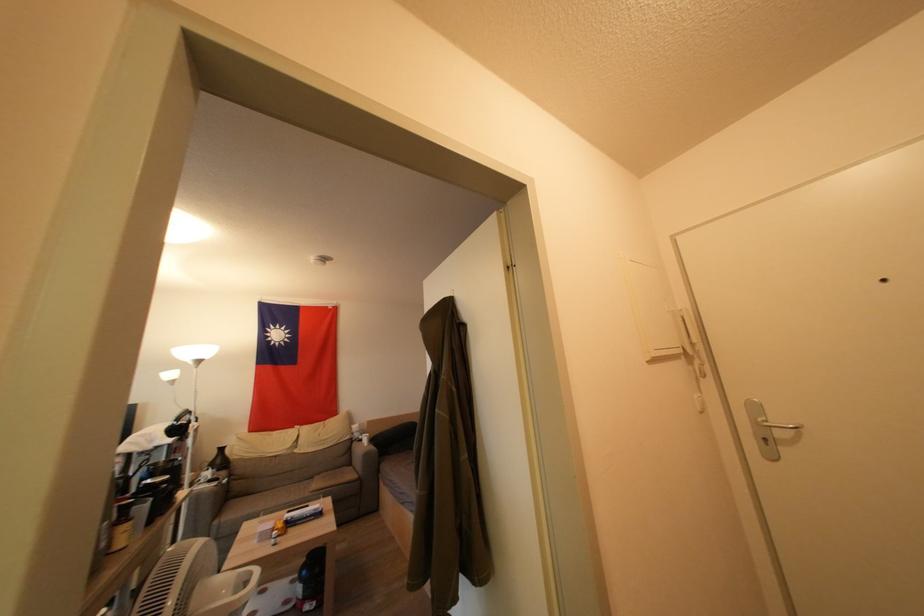
The height and width of the screenshot is (616, 924). I want to click on sofa sitting surface, so click(x=271, y=506).